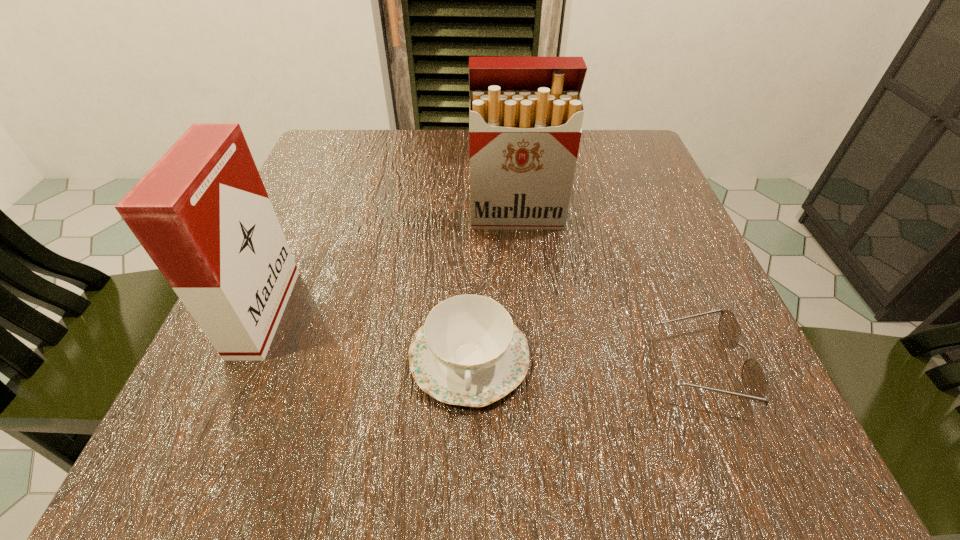
Locate an element on the screen. free space that is in between the rightmost object and the right cigarette_case is located at coordinates (608, 291).

Locate an element on the screen. vacant area between the right cigarette_case and the rightmost object is located at coordinates (608, 291).

At what (x,y) coordinates should I click in order to perform the action: click on object that is the third nearest to the rightmost object. Please return your answer as a coordinate pair (x, y). Image resolution: width=960 pixels, height=540 pixels. Looking at the image, I should click on (202, 213).

Where is `object that is the second closest to the spectacles`? This screenshot has width=960, height=540. object that is the second closest to the spectacles is located at coordinates (525, 114).

Where is `vacant space that satisfies the following two spatial constraints: 1. with the lid open on the farther cigarette_case; 2. on the front-facing side of the left cigarette_case`? This screenshot has width=960, height=540. vacant space that satisfies the following two spatial constraints: 1. with the lid open on the farther cigarette_case; 2. on the front-facing side of the left cigarette_case is located at coordinates (526, 313).